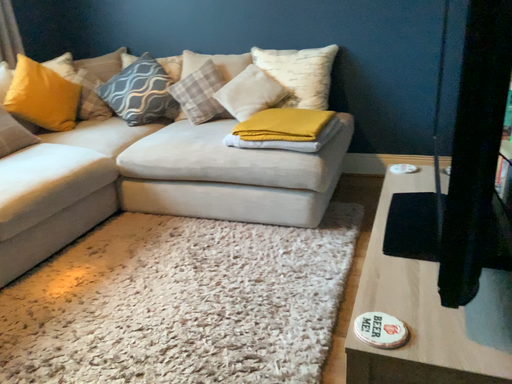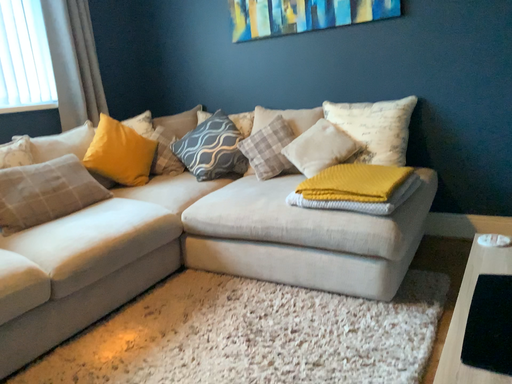
Question: How did the camera likely rotate when shooting the video?

Choices:
 (A) rotated right
 (B) rotated left

Answer: (B)